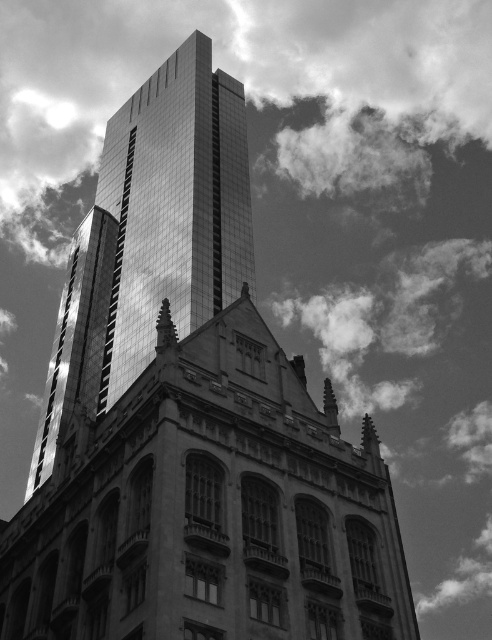
You are an architect analyzing the image. You need to determine which of the two structures, the reflective glass skyscraper at center or the smooth glass spire at center, has a greater horizontal span. Based on the scene, which one is wider?

The reflective glass skyscraper at center has a greater width than the smooth glass spire at center, so the reflective glass skyscraper at center is wider.

You are an architect analyzing the spatial relationship between the two glass structures in the image. Which of the two, the reflective glass skyscraper at center or the smooth glass spire at center, is located closer to the viewer?

The reflective glass skyscraper at center is positioned over the smooth glass spire at center, meaning it is closer to the viewer.

You are a construction worker planning to install a safety net between the reflective glass skyscraper at center and the classic Gothic building in the foreground. The safety net requires a minimum distance of 40 meters between the two structures to be effective. Can the safety net be installed effectively?

The distance between the reflective glass skyscraper at center and the classic Gothic building in the foreground is 42.60 meters, which exceeds the minimum requirement of 40 meters. Therefore, the safety net can be installed effectively between them.